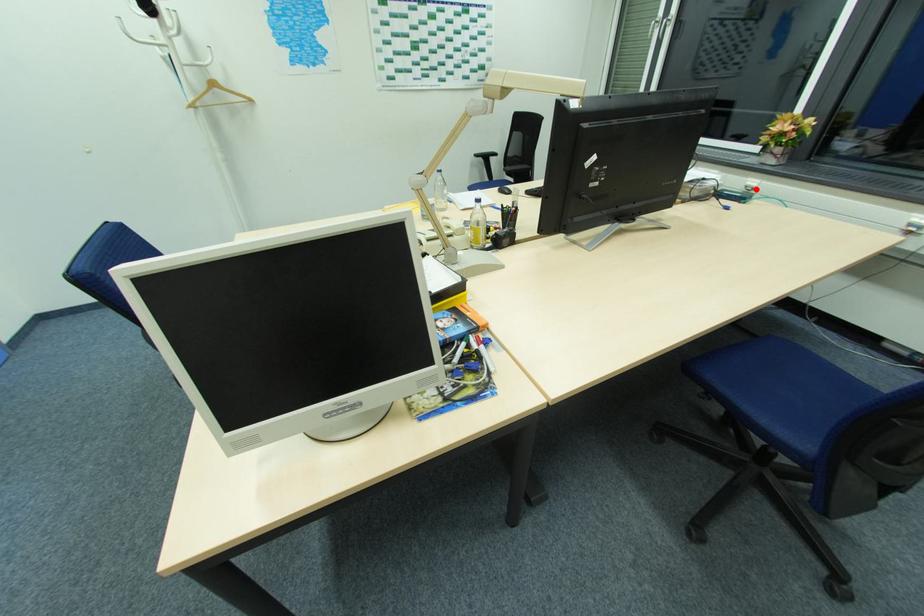
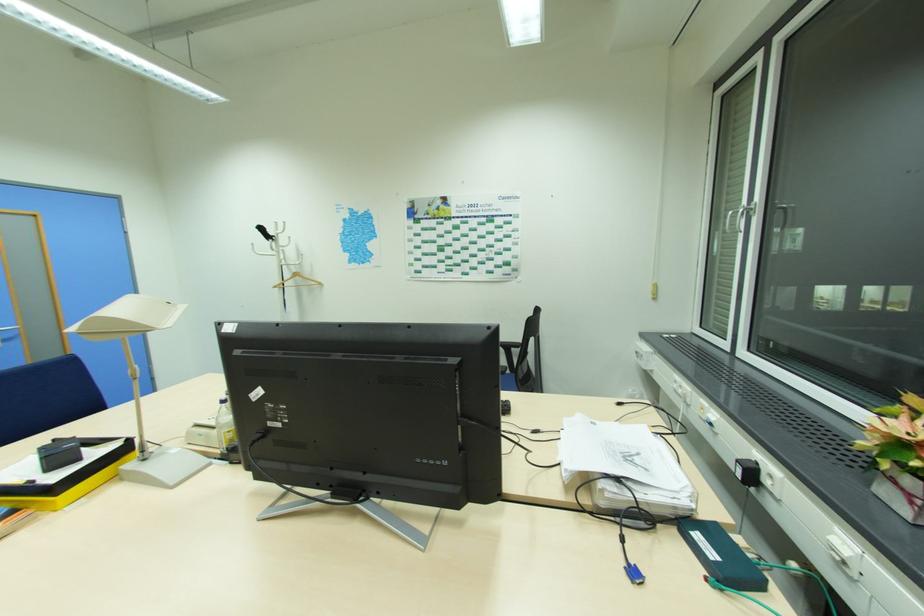
Question: I am providing you with two images of the same scene from different viewpoints. Given a red point in image1, look at the same physical point in image2. Is it:

Choices:
 (A) Closer to the viewpoint
 (B) Farther from the viewpoint

Answer: (B)